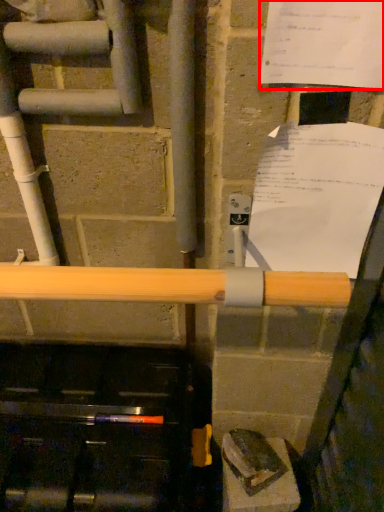
Question: In this image, where is paper (annotated by the red box) located relative to paper?

Choices:
 (A) left
 (B) right

Answer: (A)